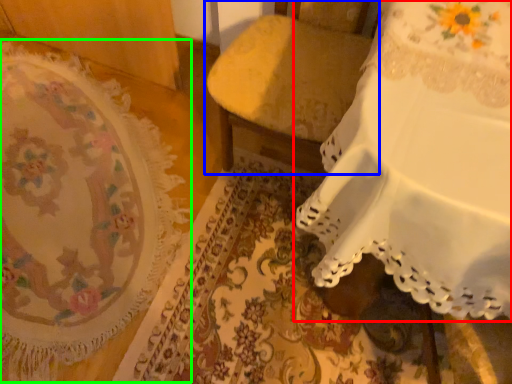
Question: Which object is the closest to the furniture (highlighted by a red box)? Choose among these: furniture (highlighted by a blue box) or mat (highlighted by a green box).

Choices:
 (A) furniture
 (B) mat

Answer: (A)